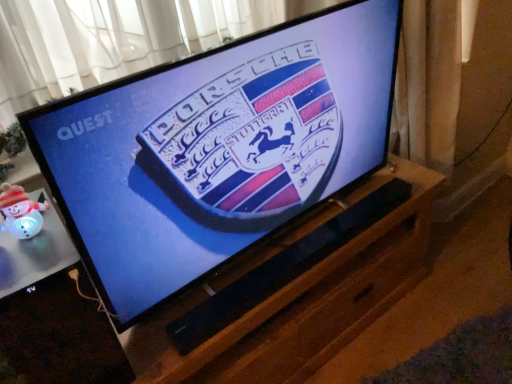
Question: Considering the positions of point (124, 374) and point (278, 210), is point (124, 374) closer or farther from the camera than point (278, 210)?

Choices:
 (A) closer
 (B) farther

Answer: (A)

Question: From a real-world perspective, is white glossy snowman at lower left positioned above or below black glossy tv at center?

Choices:
 (A) below
 (B) above

Answer: (A)

Question: Which of these objects is positioned closest to the black glossy tv at center?

Choices:
 (A) black matte speaker at center
 (B) white glossy snowman at lower left

Answer: (A)

Question: Which object is positioned closest to the white glossy snowman at lower left?

Choices:
 (A) black matte speaker at center
 (B) black glossy tv at center

Answer: (B)